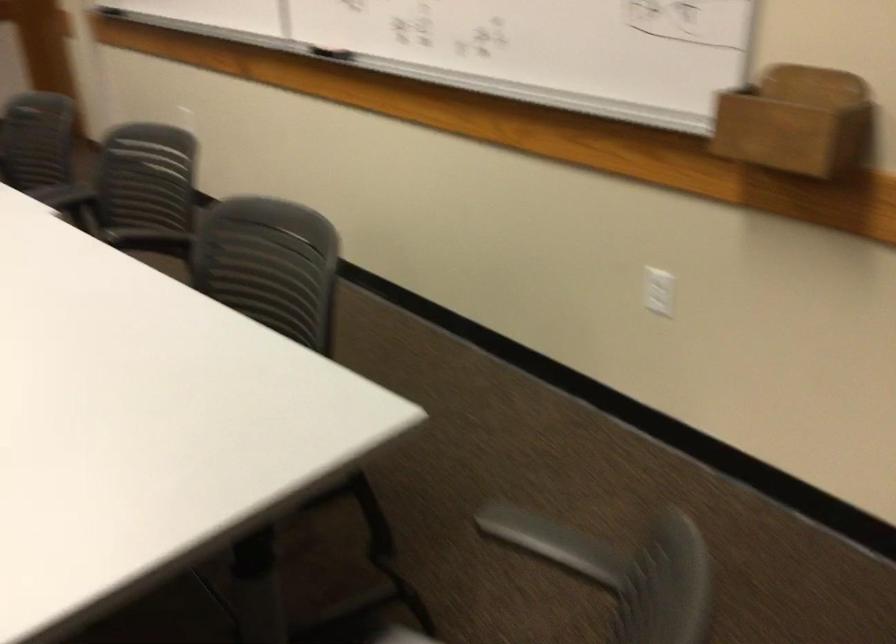
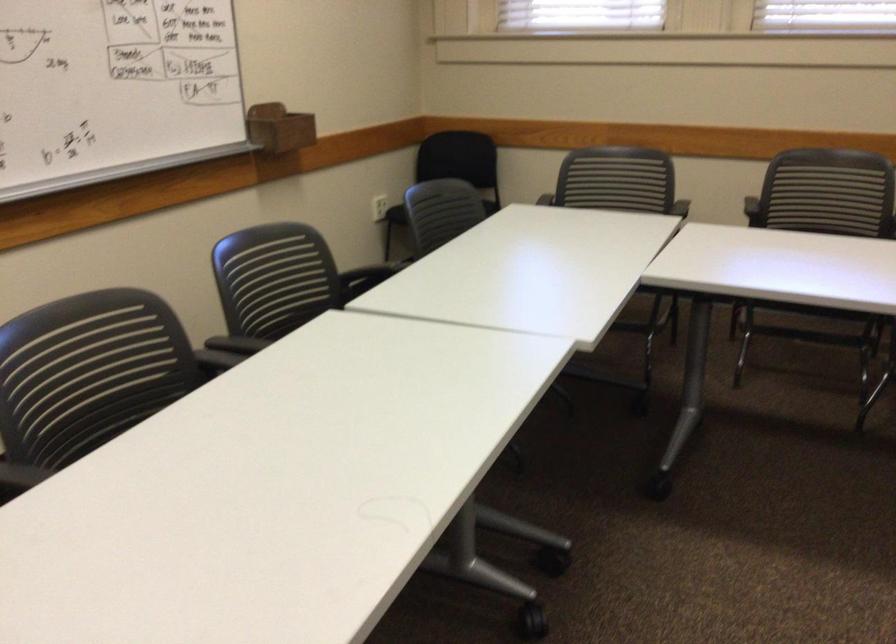
Question: I am providing you with two images of the same scene from different viewpoints. Please identify which objects are invisible in image2.

Choices:
 (A) wooden marker holder
 (B) black shoe
 (C) grey chair armrest
 (D) black chair armrest

Answer: (C)